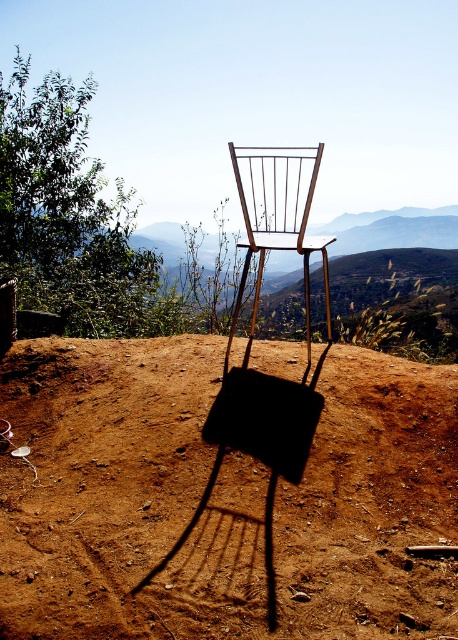
Which of these two, brown dirt field at center or metallic gold chair at center, stands shorter?

Standing shorter between the two is brown dirt field at center.

Does brown dirt field at center appear under metallic gold chair at center?

Yes, brown dirt field at center is below metallic gold chair at center.

What do you see at coordinates (221, 499) in the screenshot? I see `brown dirt field at center` at bounding box center [221, 499].

Locate an element on the screen. brown dirt field at center is located at coordinates (221, 499).

Can you confirm if metallic wire chair at center is smaller than metallic gold chair at center?

Yes.

Is point (232, 435) farther from viewer compared to point (240, 291)?

No, it is in front of (240, 291).

This screenshot has height=640, width=458. I want to click on metallic wire chair at center, so click(x=259, y=442).

You are a GUI agent. You are given a task and a screenshot of the screen. Output one action in this format:
    pyautogui.click(x=<x>, y=<y>)
    Task: Click on the brown dirt field at center
    This screenshot has height=640, width=458.
    Given the screenshot: What is the action you would take?
    pyautogui.click(x=221, y=499)

Based on the photo, measure the distance between brown dirt field at center and metallic wire chair at center.

brown dirt field at center and metallic wire chair at center are 40.76 centimeters apart from each other.

This screenshot has width=458, height=640. What do you see at coordinates (221, 499) in the screenshot? I see `brown dirt field at center` at bounding box center [221, 499].

Where is `brown dirt field at center`? The height and width of the screenshot is (640, 458). brown dirt field at center is located at coordinates (221, 499).